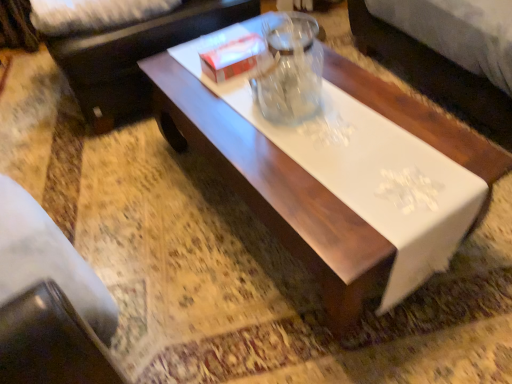
Question: Should I look upward or downward to see dark brown leather couch at upper left?

Choices:
 (A) up
 (B) down

Answer: (A)

Question: Is the depth of white cardboard box at center less than that of white glossy coffee table at center?

Choices:
 (A) yes
 (B) no

Answer: (B)

Question: From the image's perspective, is white cardboard box at center located beneath white glossy coffee table at center?

Choices:
 (A) yes
 (B) no

Answer: (B)

Question: Considering the relative positions of white cardboard box at center and white glossy coffee table at center in the image provided, is white cardboard box at center to the right of white glossy coffee table at center from the viewer's perspective?

Choices:
 (A) no
 (B) yes

Answer: (A)

Question: Does white cardboard box at center appear on the left side of white glossy coffee table at center?

Choices:
 (A) no
 (B) yes

Answer: (B)

Question: Is white cardboard box at center oriented towards white glossy coffee table at center?

Choices:
 (A) yes
 (B) no

Answer: (B)

Question: Is white cardboard box at center beside white glossy coffee table at center?

Choices:
 (A) no
 (B) yes

Answer: (A)

Question: Is dark brown leather couch at upper left completely or partially outside of white cardboard box at center?

Choices:
 (A) no
 (B) yes

Answer: (B)

Question: Is dark brown leather couch at upper left behind white cardboard box at center?

Choices:
 (A) no
 (B) yes

Answer: (B)

Question: Is dark brown leather couch at upper left looking in the opposite direction of white cardboard box at center?

Choices:
 (A) no
 (B) yes

Answer: (A)

Question: Is dark brown leather couch at upper left taller than white cardboard box at center?

Choices:
 (A) no
 (B) yes

Answer: (B)

Question: Can you see dark brown leather couch at upper left touching white cardboard box at center?

Choices:
 (A) yes
 (B) no

Answer: (B)

Question: Does dark brown leather couch at upper left turn towards white cardboard box at center?

Choices:
 (A) no
 (B) yes

Answer: (B)

Question: Is dark brown leather couch at upper left further to the viewer compared to white glossy coffee table at center?

Choices:
 (A) no
 (B) yes

Answer: (B)